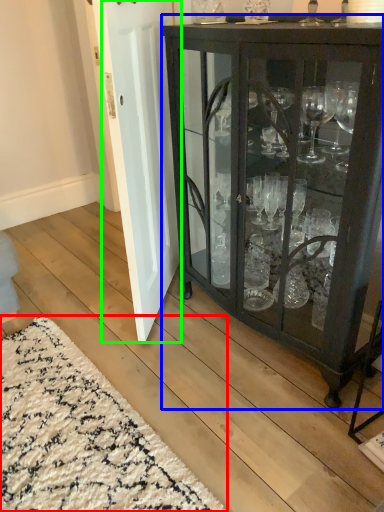
Question: Which object is positioned closest to doormat (highlighted by a red box)? Select from cupboard (highlighted by a blue box) and door (highlighted by a green box).

Choices:
 (A) cupboard
 (B) door

Answer: (B)